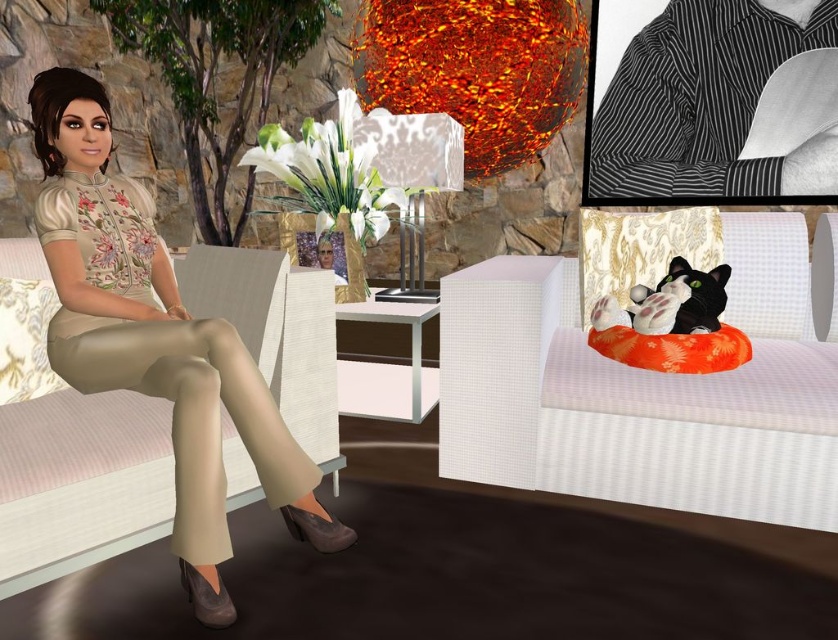
You are a fashion designer observing a model wearing the beige fabric pants at left and the striped fabric shirt at upper right. Which piece of clothing is positioned more to the left side of the model?

The beige fabric pants at left are positioned more to the left side of the model than the striped fabric shirt at upper right.

You are an interior designer assessing the placement of fabrics in a room. You notice the beige fabric pants at left and the striped fabric shirt at upper right. Which fabric item is closer to you as you stand in the room?

The beige fabric pants at left are closer to you because they are positioned in front of the striped fabric shirt at upper right.

You are a guest in this living room and want to sit down. The orange fabric couch at right and the beige fabric pants at left are both available. Which one is lower to the ground, making it easier to sit?

The orange fabric couch at right is shorter than the beige fabric pants at left, so it is lower to the ground and easier to sit on.